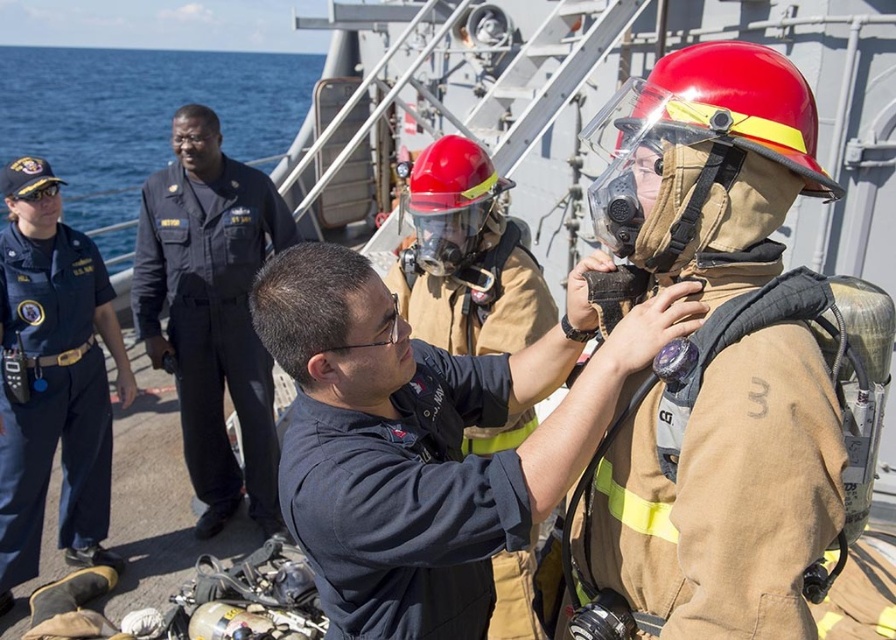
Question: Which of these objects is positioned farthest from the brown/cotton fire suit at center?

Choices:
 (A) dark blue fabric shirt at center
 (B) blue uniform at left

Answer: (B)

Question: Does matte khaki uniform at center appear over blue uniform at left?

Choices:
 (A) yes
 (B) no

Answer: (A)

Question: Considering the relative positions of dark blue uniform at center and dark blue uniform at left in the image provided, where is dark blue uniform at center located with respect to dark blue uniform at left?

Choices:
 (A) below
 (B) above

Answer: (A)

Question: Which object is the closest to the dark blue fabric shirt at center?

Choices:
 (A) brown/cotton fire suit at center
 (B) matte khaki uniform at center

Answer: (B)

Question: Which point is farther to the camera?

Choices:
 (A) blue uniform at left
 (B) brown/cotton fire suit at center
 (C) dark blue fabric shirt at center
 (D) dark blue uniform at left

Answer: (D)

Question: Can you confirm if matte khaki uniform at center is positioned to the left of dark blue fabric shirt at center?

Choices:
 (A) yes
 (B) no

Answer: (B)